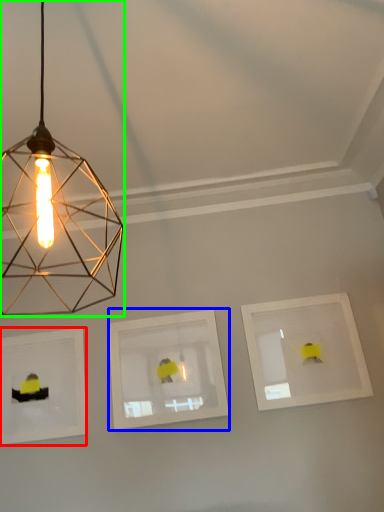
Question: Based on their relative distances, which object is farther from picture frame (highlighted by a red box)? Choose from picture frame (highlighted by a blue box) and lamp (highlighted by a green box).

Choices:
 (A) picture frame
 (B) lamp

Answer: (B)